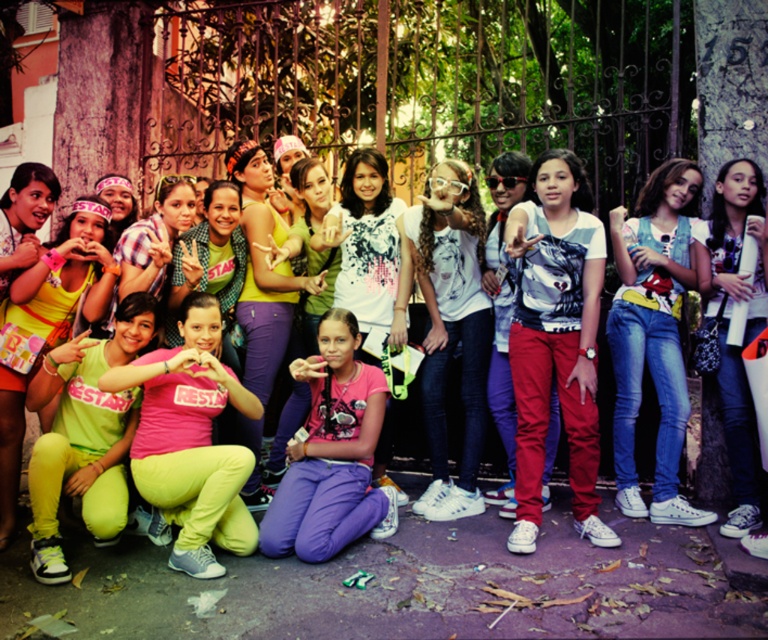
Can you confirm if pink matte shirt at center is smaller than matte yellow pants at lower left?

No, pink matte shirt at center is not smaller than matte yellow pants at lower left.

Is point (371, 387) less distant than point (104, 240)?

Yes, point (371, 387) is closer to viewer.

Find the location of a particular element. pink matte shirt at center is located at coordinates (330, 452).

Is denim jeans at right above matte yellow pants at lower left?

Yes.

Where is `denim jeans at right`? The width and height of the screenshot is (768, 640). denim jeans at right is located at coordinates (654, 333).

Based on the photo, is denim jeans at right positioned before pink matte shirt at center?

No, it is behind pink matte shirt at center.

Who is more forward, (614, 305) or (359, 445)?

Point (359, 445) is in front.

Identify the location of denim jeans at right. This screenshot has height=640, width=768. (654, 333).